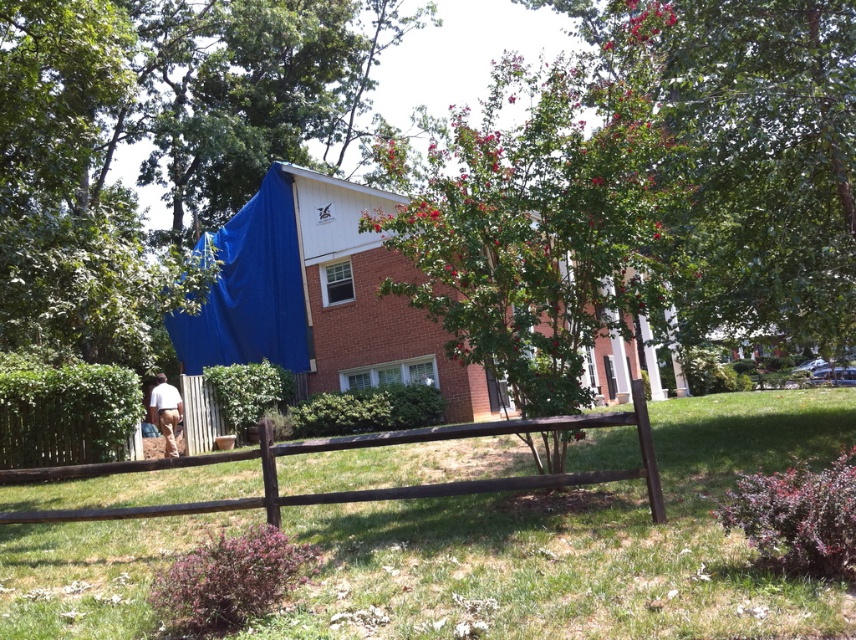
You are a delivery person trying to place a small package on the brown wooden fence at lower left. However, you notice the white matte shorts at lower left nearby. Which object is shorter and thus more suitable for placing the package?

The brown wooden fence at lower left is shorter than the white matte shorts at lower left, making it more suitable for placing the package.

In the scene shown: You are standing in the residential outdoor scene and want to walk from the brown wooden fence at lower left to the brown wooden fence at center. Can you step directly between them without going around?

The brown wooden fence at lower left is positioned under the brown wooden fence at center, so there is no space between them for you to step directly through. You would need to go around them.